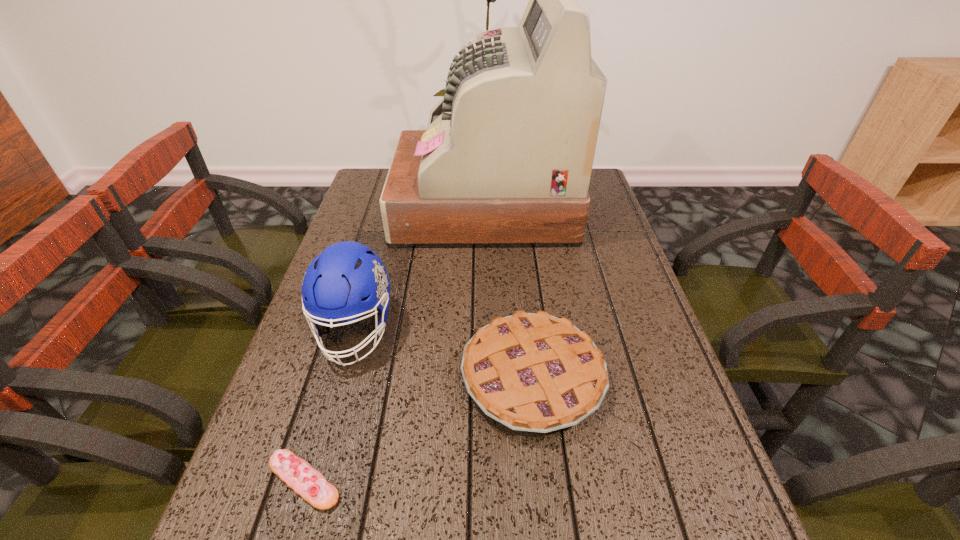
The height and width of the screenshot is (540, 960). Identify the location of the farthest object. (506, 160).

This screenshot has height=540, width=960. In order to click on the tallest object in this screenshot , I will do `click(506, 160)`.

Where is `the second tallest object`? the second tallest object is located at coordinates (334, 283).

Locate an element on the screen. The image size is (960, 540). pie is located at coordinates (537, 373).

At what (x,y) coordinates should I click in order to perform the action: click on eclair. Please return your answer as a coordinate pair (x, y). This screenshot has height=540, width=960. Looking at the image, I should click on (298, 474).

Where is `the shortest object`? the shortest object is located at coordinates (298, 474).

You are a GUI agent. You are given a task and a screenshot of the screen. Output one action in this format:
    pyautogui.click(x=<x>, y=<y>)
    Task: Click on the free space located on the operating side of the tallest object
    
    Given the screenshot: What is the action you would take?
    pyautogui.click(x=354, y=204)

Locate an element on the screen. This screenshot has width=960, height=540. vacant space located on the face guard of the football helmet is located at coordinates (298, 532).

Where is `free spot located on the left of the pie`? This screenshot has height=540, width=960. free spot located on the left of the pie is located at coordinates (381, 378).

Locate an element on the screen. vacant space located 0.220m on the back of the shortest object is located at coordinates (343, 352).